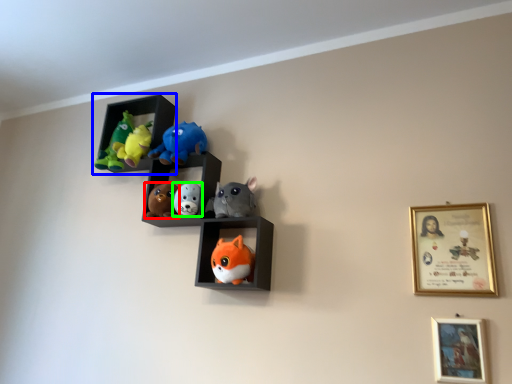
Question: Considering the real-world distances, which object is farthest from toy (highlighted by a red box)? shelf (highlighted by a blue box) or toy (highlighted by a green box)?

Choices:
 (A) shelf
 (B) toy

Answer: (A)